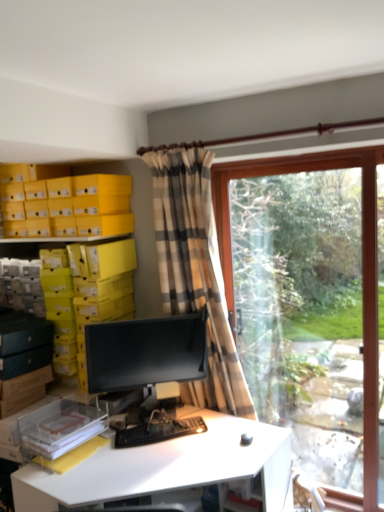
Question: From a real-world perspective, is yellow cardboard boxes at upper left physically below black matte keyboard at center?

Choices:
 (A) no
 (B) yes

Answer: (A)

Question: Is yellow cardboard boxes at upper left further to camera compared to black matte keyboard at center?

Choices:
 (A) no
 (B) yes

Answer: (B)

Question: Can you confirm if yellow cardboard boxes at upper left is taller than black matte keyboard at center?

Choices:
 (A) no
 (B) yes

Answer: (B)

Question: Is yellow cardboard boxes at upper left in contact with black matte keyboard at center?

Choices:
 (A) no
 (B) yes

Answer: (A)

Question: From a real-world perspective, is yellow cardboard boxes at upper left positioned over black matte keyboard at center based on gravity?

Choices:
 (A) no
 (B) yes

Answer: (B)

Question: Is black matte keyboard at center to the left or to the right of clear glass window at right in the image?

Choices:
 (A) left
 (B) right

Answer: (A)

Question: Considering the positions of black matte keyboard at center and clear glass window at right in the image, is black matte keyboard at center taller or shorter than clear glass window at right?

Choices:
 (A) short
 (B) tall

Answer: (A)

Question: Is black matte keyboard at center inside the boundaries of clear glass window at right, or outside?

Choices:
 (A) outside
 (B) inside

Answer: (A)

Question: In terms of size, does black matte keyboard at center appear bigger or smaller than clear glass window at right?

Choices:
 (A) small
 (B) big

Answer: (A)

Question: In terms of height, does white glossy desk at center look taller or shorter compared to black matte keyboard at center?

Choices:
 (A) tall
 (B) short

Answer: (A)

Question: Considering their positions, is white glossy desk at center located in front of or behind black matte keyboard at center?

Choices:
 (A) front
 (B) behind

Answer: (A)

Question: Based on their positions, is white glossy desk at center located to the left or right of black matte keyboard at center?

Choices:
 (A) right
 (B) left

Answer: (A)

Question: Based on their sizes in the image, would you say white glossy desk at center is bigger or smaller than black matte keyboard at center?

Choices:
 (A) small
 (B) big

Answer: (B)

Question: Would you say black matte keyboard at center is inside or outside yellow cardboard boxes at upper left?

Choices:
 (A) inside
 (B) outside

Answer: (B)

Question: In the image, is black matte keyboard at center on the left side or the right side of yellow cardboard boxes at upper left?

Choices:
 (A) left
 (B) right

Answer: (B)